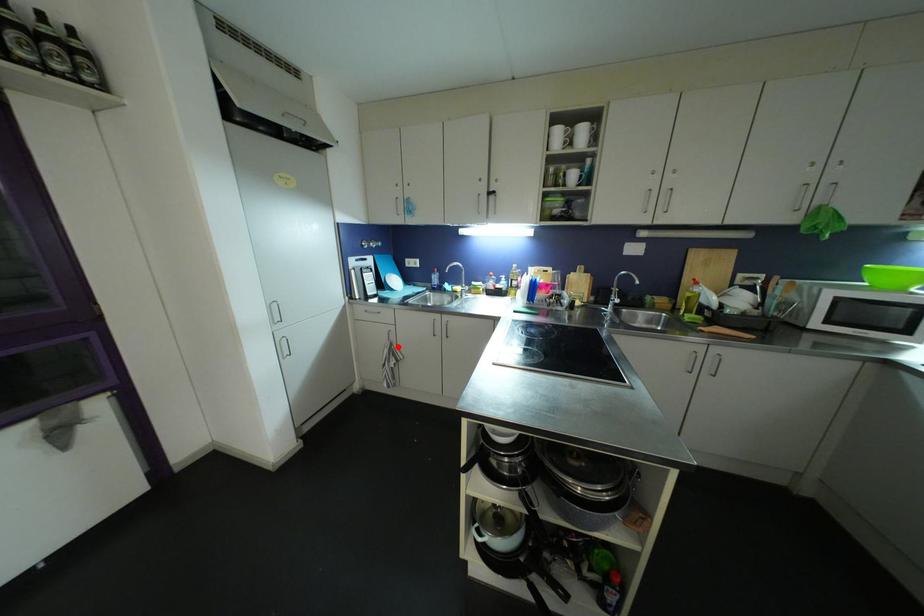
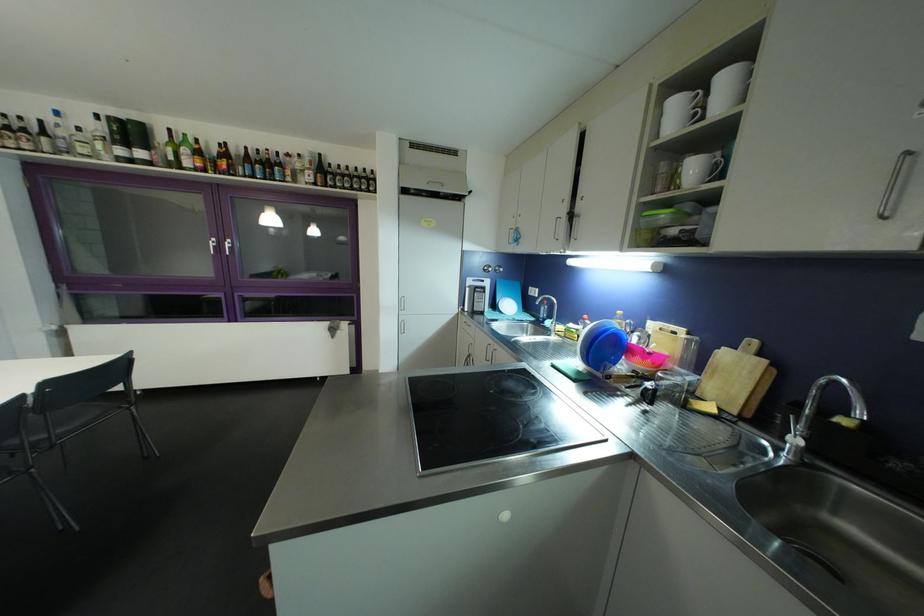
Find the pixel in the second image that matches the highlighted location in the first image.

(476, 359)